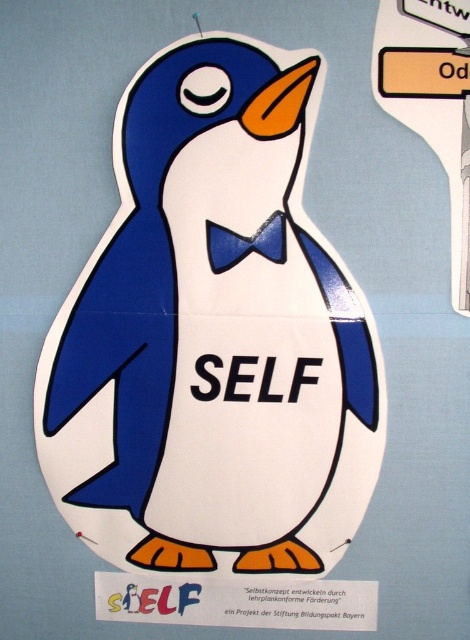
Question: Can you confirm if matte paper penguin at center is bigger than blue fabric bow tie at center?

Choices:
 (A) yes
 (B) no

Answer: (A)

Question: Does matte paper penguin at center have a greater width compared to blue fabric bow tie at center?

Choices:
 (A) yes
 (B) no

Answer: (A)

Question: Can you confirm if orange plastic sign at upper right is bigger than blue fabric bow tie at center?

Choices:
 (A) yes
 (B) no

Answer: (A)

Question: Which point is closer to the camera?

Choices:
 (A) (321, 474)
 (B) (241, 236)

Answer: (B)

Question: Which point is closer to the camera taking this photo?

Choices:
 (A) (172, 410)
 (B) (400, 19)

Answer: (B)

Question: Considering the real-world distances, which object is closest to the orange plastic sign at upper right?

Choices:
 (A) matte paper penguin at center
 (B) blue fabric bow tie at center

Answer: (A)